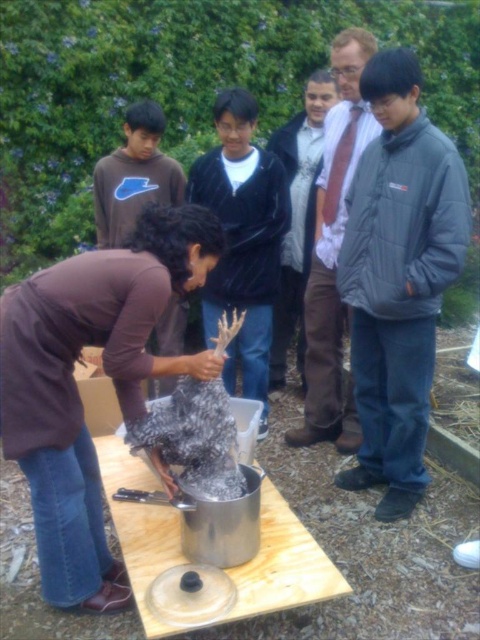
You are standing at the point marked by the coordinates point (334,252). What object is located at that position?

The point (334,252) marks the brown leather jacket at upper center.

You are a photographer trying to capture a photo of both the brown leather jacket at upper center and the light brown leather jacket at center in the same frame. Given that your camera has a focal length of 50mm and a sensor size of 24x36mm, can you estimate if the jackets are within the camera sensor field of view? Please consider the distance between them and the camera specifications provided.

The distance between the brown leather jacket at upper center and the light brown leather jacket at center is 14.96 inches. With a 50mm focal length and a sensor size of 24x36mm, the horizontal field of view is approximately 39 degrees, covering about 45.5 inches at a typical shooting distance. Since 14.96 inches is less than 45.5 inches, both jackets can fit within the camera sensor field of view.

You are organizing a picnic and need to pack both the shiny silver pot at center and the brown soft sweater at center. Which item should you pack first if you want to place the larger item in your bag first?

The shiny silver pot at center is bigger than the brown soft sweater at center, so you should pack the shiny silver pot at center first.